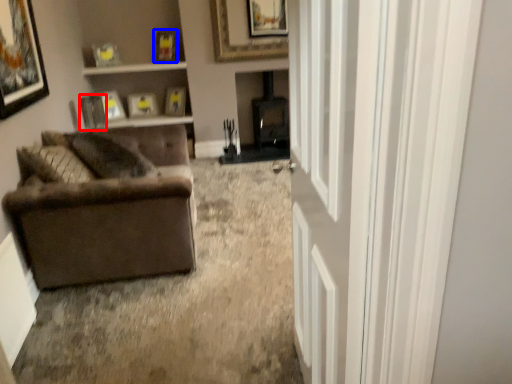
Question: Among these objects, which one is farthest to the camera, picture frame (highlighted by a red box) or picture frame (highlighted by a blue box)?

Choices:
 (A) picture frame
 (B) picture frame

Answer: (B)